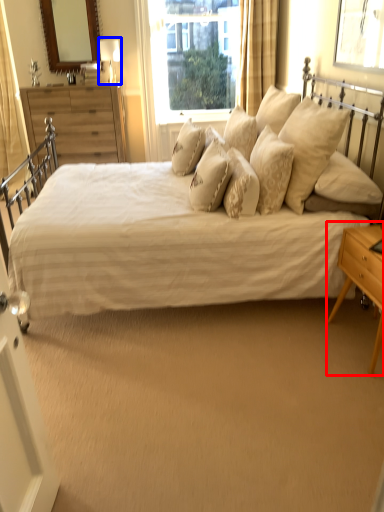
Question: Which object is closer to the camera taking this photo, nightstand (highlighted by a red box) or table lamp (highlighted by a blue box)?

Choices:
 (A) nightstand
 (B) table lamp

Answer: (A)